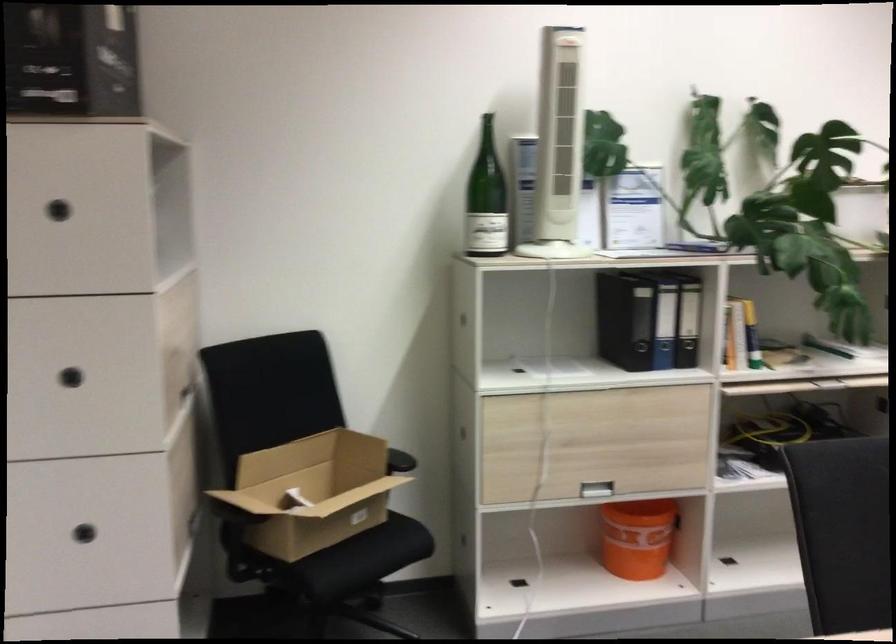
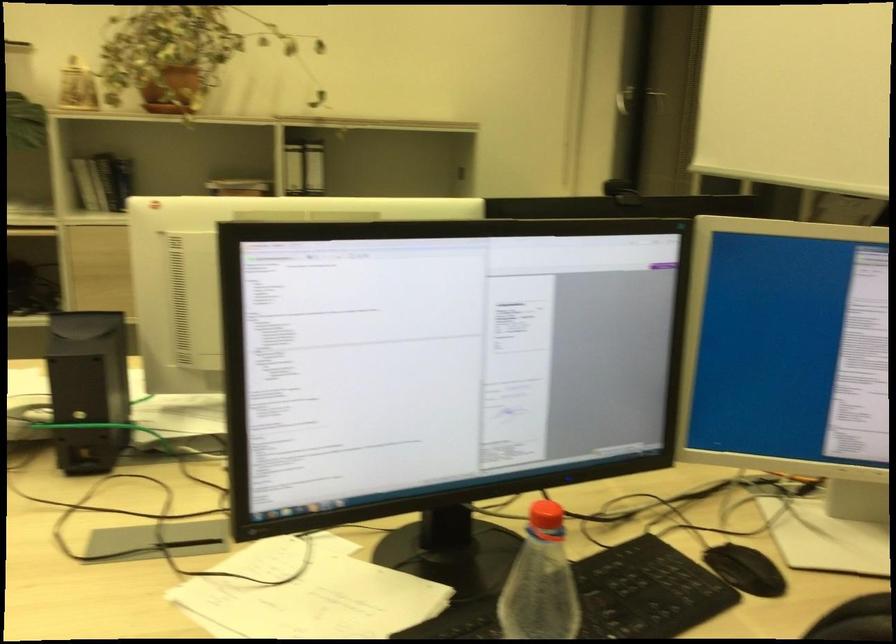
Question: What movement of the cameraman would produce the second image?

Choices:
 (A) Left
 (B) Right
 (C) Forward
 (D) Backward

Answer: (B)